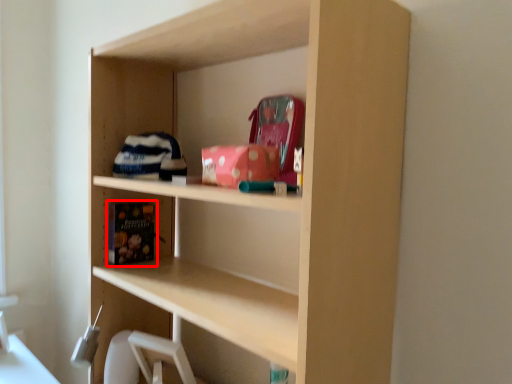
Question: From the image's perspective, where is book (annotated by the red box) located relative to book?

Choices:
 (A) below
 (B) above

Answer: (A)